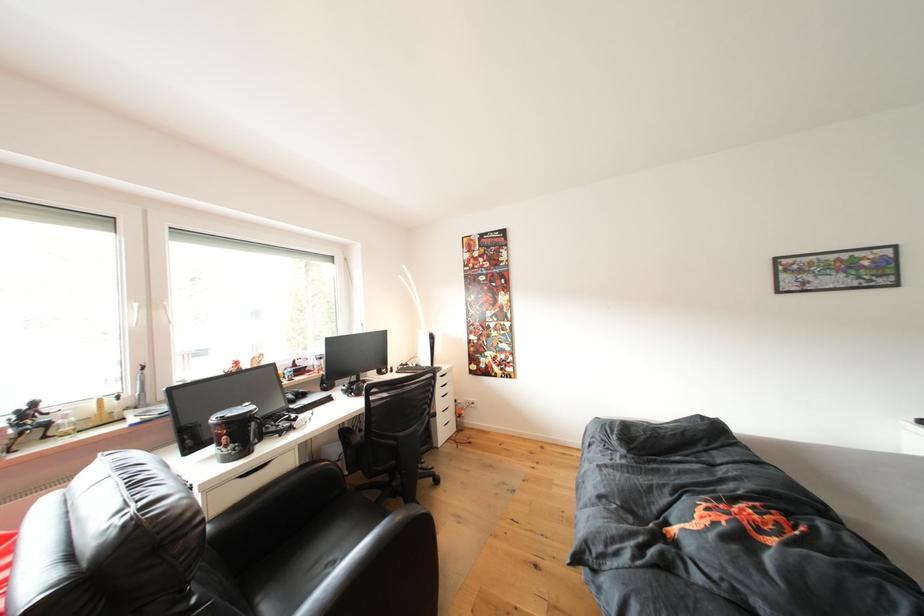
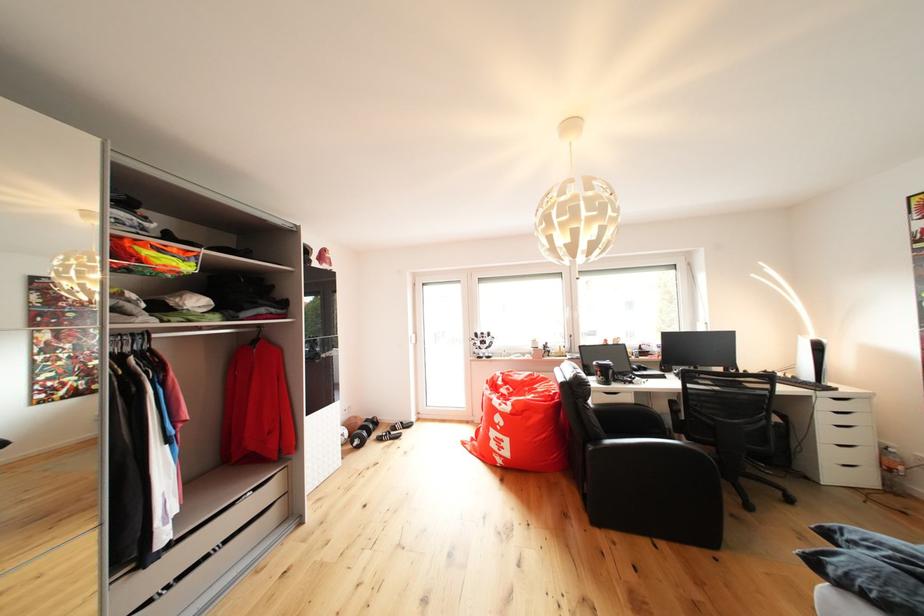
Locate, in the second image, the point that corresponds to the point at 237,427 in the first image.

(609, 371)